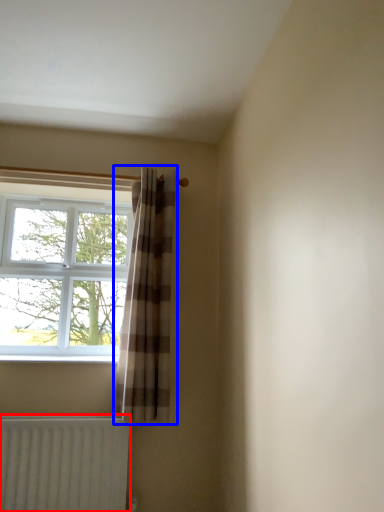
Question: Which of the following is the closest to the observer, radiator (highlighted by a red box) or curtain (highlighted by a blue box)?

Choices:
 (A) radiator
 (B) curtain

Answer: (A)